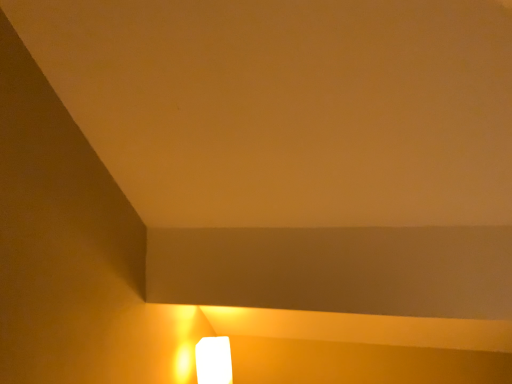
Identify the location of white plastic lamp at lower left. The width and height of the screenshot is (512, 384). (213, 360).

In order to face white plastic lamp at lower left, should I rotate leftwards or rightwards?

Rotate your view left by about 5.471°.

Describe the element at coordinates (213, 360) in the screenshot. I see `white plastic lamp at lower left` at that location.

Locate an element on the screen. white plastic lamp at lower left is located at coordinates (213, 360).